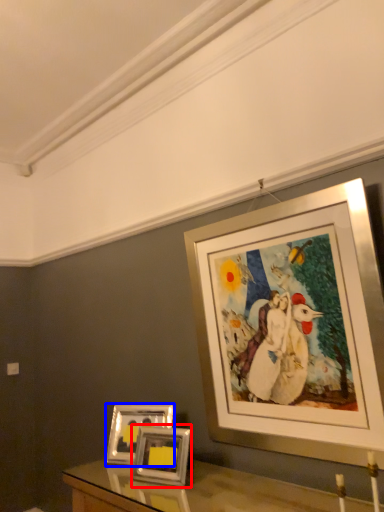
Question: Among these objects, which one is nearest to the camera, picture frame (highlighted by a red box) or picture frame (highlighted by a blue box)?

Choices:
 (A) picture frame
 (B) picture frame

Answer: (A)